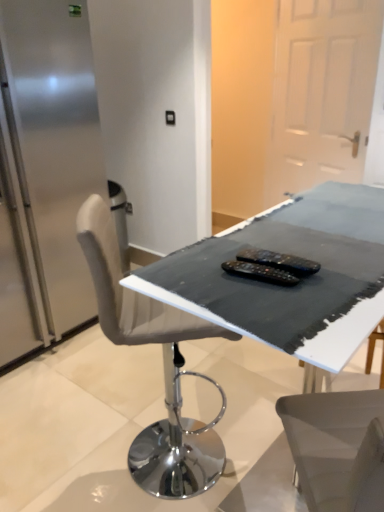
Locate an element on the screen. The width and height of the screenshot is (384, 512). free space in front of black plastic remote controls at center, the second equipment ordered from the bottom is located at coordinates (283, 301).